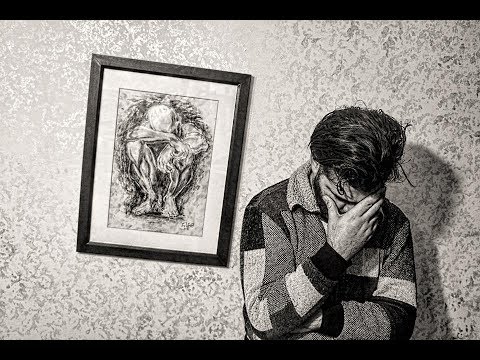
You are a GUI agent. You are given a task and a screenshot of the screen. Output one action in this format:
    pyautogui.click(x=<x>, y=<y>)
    Task: Click on the black, white, gray wall background
    The image size is (480, 360).
    Given the screenshot: What is the action you would take?
    [x=68, y=302]